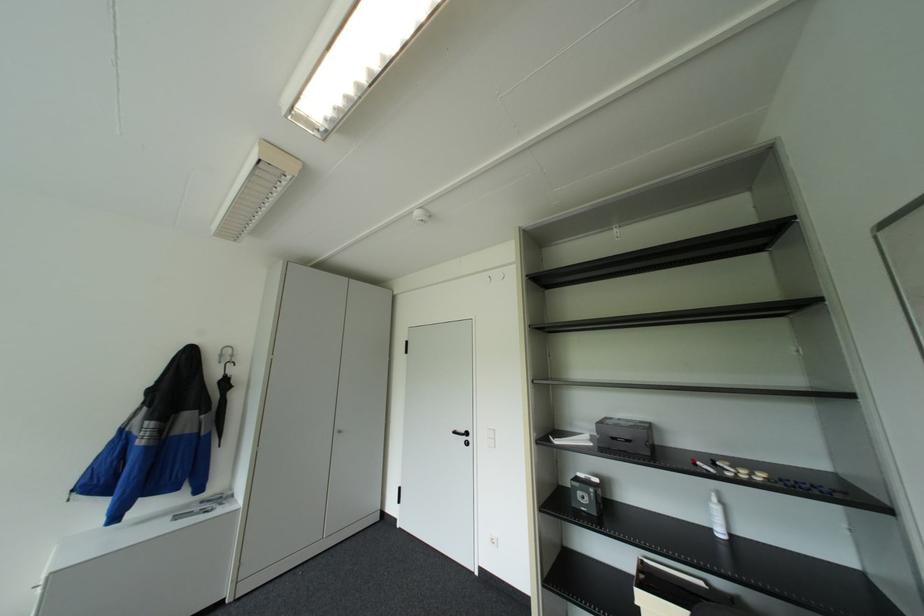
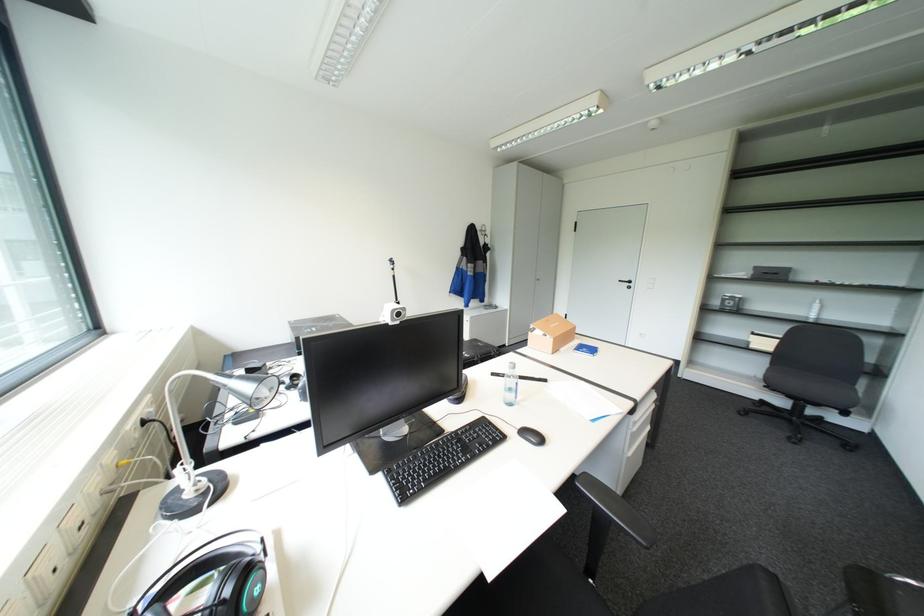
What movement of the cameraman would produce the second image?

The movement direction of the cameraman is left, backward.